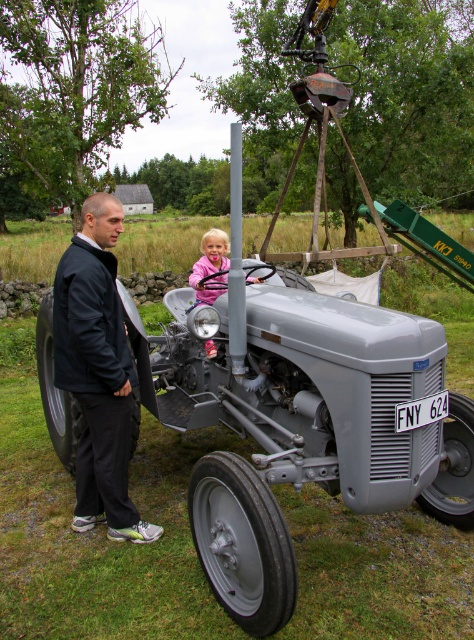
You are a surveyor tasked with mapping coordinates in a rural area. You observe the metallic gray tractor at center in the scene. What are its coordinates?

The coordinates of the metallic gray tractor at center are at point [300,422].

You are a farmer checking the tractor. You notice the metallic gray tractor at center and the pink fabric at center. Which object is positioned lower in the image?

The metallic gray tractor at center is located below the pink fabric at center, so it is positioned lower in the image.